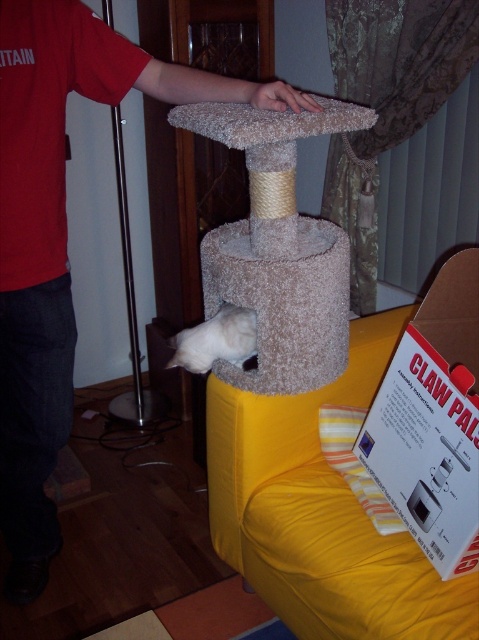
Question: Is red cotton shirt at upper left to the left of white fluffy cat at lower center from the viewer's perspective?

Choices:
 (A) yes
 (B) no

Answer: (A)

Question: Which object appears farthest from the camera in this image?

Choices:
 (A) white fluffy cat at lower center
 (B) red cotton shirt at upper left

Answer: (A)

Question: Which object is farther from the camera taking this photo?

Choices:
 (A) white fluffy cat at lower center
 (B) red cotton shirt at upper left

Answer: (A)

Question: Is red cotton shirt at upper left thinner than white fluffy cat at lower center?

Choices:
 (A) yes
 (B) no

Answer: (B)

Question: Considering the relative positions of red cotton shirt at upper left and white fluffy cat at lower center in the image provided, where is red cotton shirt at upper left located with respect to white fluffy cat at lower center?

Choices:
 (A) above
 (B) below

Answer: (B)